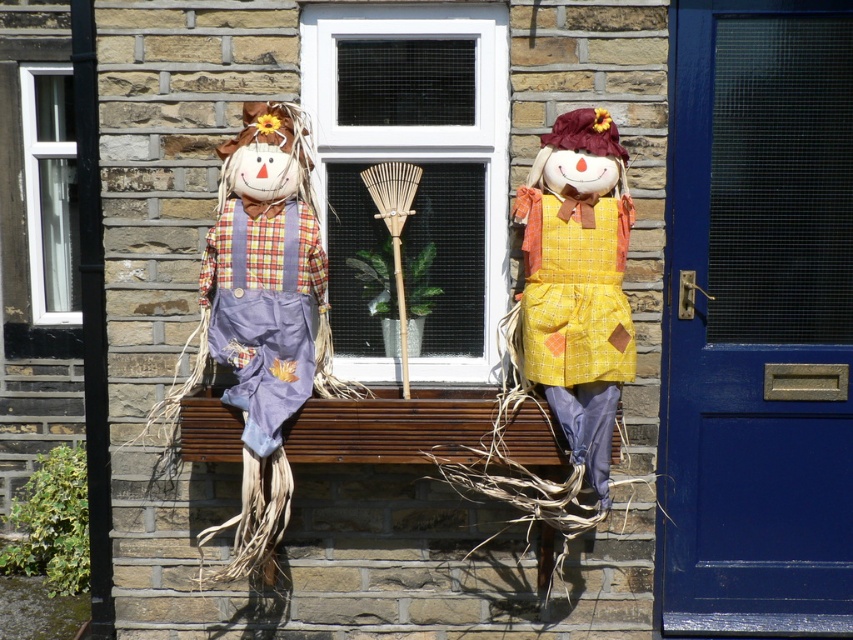
Question: Does clear glass window at center lie in front of yellow fabric doll at center?

Choices:
 (A) yes
 (B) no

Answer: (B)

Question: Can you confirm if yellow fabric doll at center is positioned above wooden bench at center?

Choices:
 (A) yes
 (B) no

Answer: (A)

Question: Estimate the real-world distances between objects in this image. Which object is farther from the wooden bench at center?

Choices:
 (A) yellow fabric doll at center
 (B) matte purple overalls at left

Answer: (A)

Question: Which point is farther to the camera?

Choices:
 (A) yellow fabric doll at center
 (B) matte purple overalls at left
 (C) clear glass window at center

Answer: (C)

Question: Considering the real-world distances, which object is closest to the matte purple overalls at left?

Choices:
 (A) yellow fabric doll at center
 (B) wooden bench at center
 (C) clear glass window at center

Answer: (B)

Question: Where is matte purple overalls at left located in relation to yellow fabric doll at center in the image?

Choices:
 (A) left
 (B) right

Answer: (A)